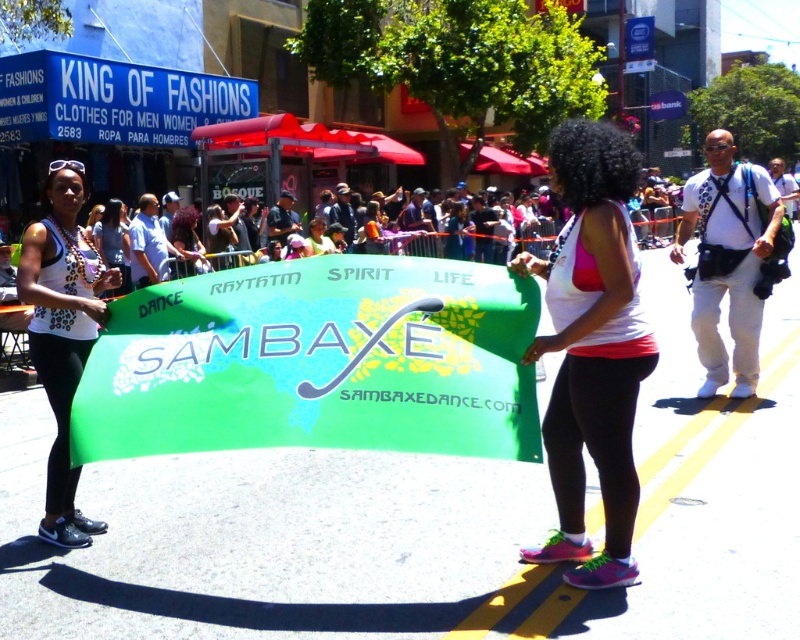
You are a photographer standing in the middle of the street. You see the white matte tank top at center and the white leopard print tank top at left. Can you fit both of them in your camera frame if your camera has a 10 feet wide field of view?

The white matte tank top at center and white leopard print tank top at left are 9.21 feet apart from each other. Since the distance between them is less than the camera field of view of 10 feet, both can be captured in the frame.